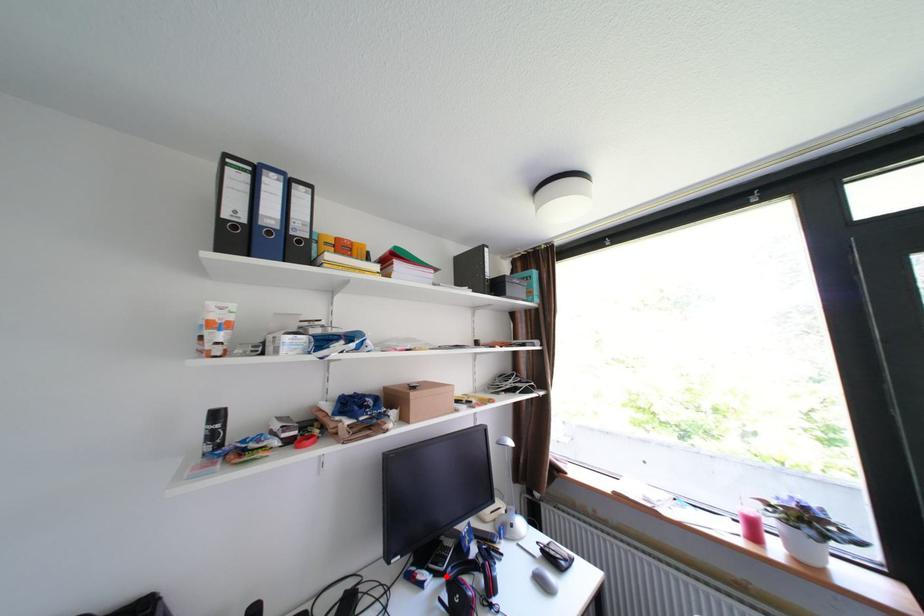
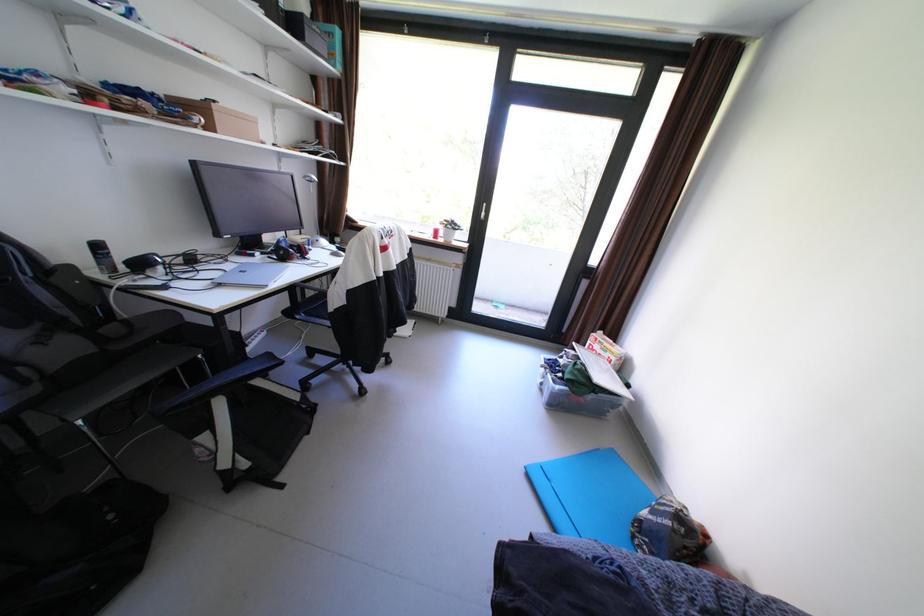
The point at the highlighted location is marked in the first image. Where is the corresponding point in the second image?

(274, 254)